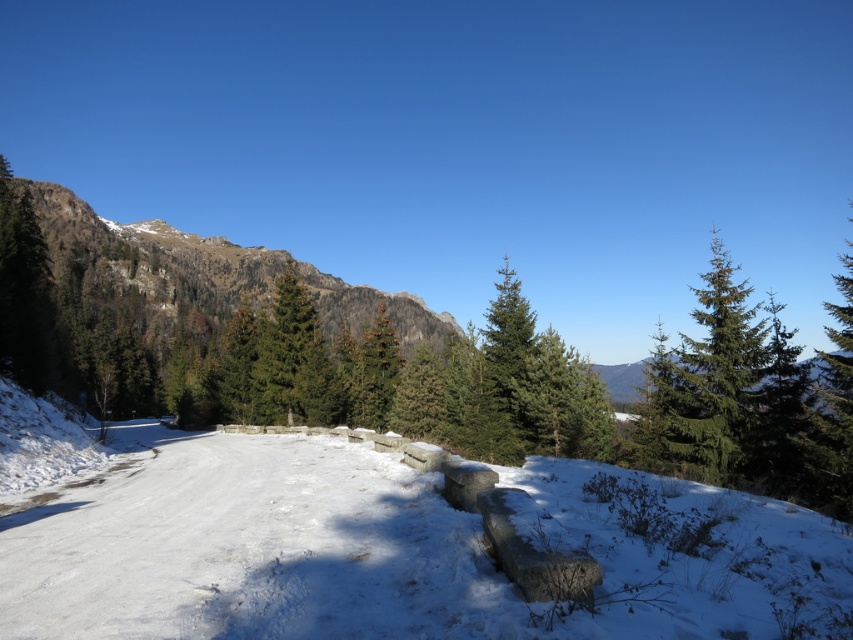
You are a park visitor who wants to take a photo of the white snow at center and the green matte evergreen tree at center. Which object is closer to the camera in the image?

The white snow at center is positioned under the green matte evergreen tree at center, so the green matte evergreen tree at center is closer to the camera.

In the scene shown: You are planning to take a photo of the rugged stone mountain at left and the green matte evergreen tree at center from a position where both are visible. Which object will occupy more horizontal space in your photo?

The rugged stone mountain at left will occupy more horizontal space in the photo because its width surpasses that of the green matte evergreen tree at center.

You are an outdoor enthusiast planning a hike and see the rugged stone mountain at left and the green matte evergreen tree at center in the distance. Which object is closer to you as you stand at the starting point?

The rugged stone mountain at left is closer to you because it is positioned further to the viewer than the green matte evergreen tree at center, meaning it appears nearer in the scene.